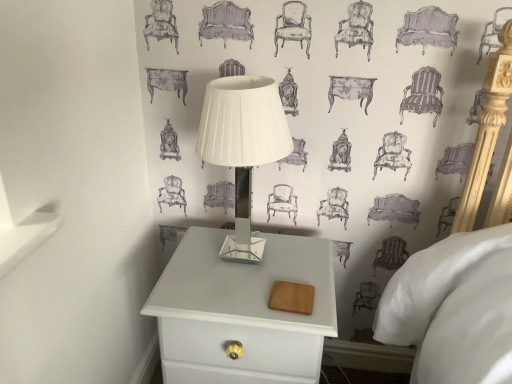
The height and width of the screenshot is (384, 512). In order to click on white glossy table lamp at center in this screenshot , I will do `click(243, 142)`.

This screenshot has width=512, height=384. What do you see at coordinates (243, 142) in the screenshot?
I see `white glossy table lamp at center` at bounding box center [243, 142].

Image resolution: width=512 pixels, height=384 pixels. What are the coordinates of `white matte nightstand at lower center` in the screenshot? It's located at (241, 311).

Describe the element at coordinates (241, 311) in the screenshot. The height and width of the screenshot is (384, 512). I see `white matte nightstand at lower center` at that location.

Where is `white glossy table lamp at center`? white glossy table lamp at center is located at coordinates (243, 142).

Between white matte nightstand at lower center and white glossy table lamp at center, which one appears on the left side from the viewer's perspective?

white glossy table lamp at center.

Which object is further away from the camera taking this photo, white matte nightstand at lower center or white glossy table lamp at center?

white matte nightstand at lower center is further away from the camera.

Is point (237, 373) in front of point (213, 162)?

No, it is not.

From the image's perspective, which is below, white matte nightstand at lower center or white glossy table lamp at center?

white matte nightstand at lower center.

From a real-world perspective, is white matte nightstand at lower center positioned above or below white glossy table lamp at center?

white matte nightstand at lower center is below white glossy table lamp at center.

Looking at their sizes, would you say white matte nightstand at lower center is wider or thinner than white glossy table lamp at center?

Considering their sizes, white matte nightstand at lower center looks broader than white glossy table lamp at center.

Who is taller, white matte nightstand at lower center or white glossy table lamp at center?

white matte nightstand at lower center is taller.

Does white matte nightstand at lower center have a larger size compared to white glossy table lamp at center?

Yes.

Does white matte nightstand at lower center contain white glossy table lamp at center?

No.

Is the surface of white matte nightstand at lower center in direct contact with white glossy table lamp at center?

white matte nightstand at lower center and white glossy table lamp at center are not in contact.

Looking at this image, is white matte nightstand at lower center positioned with its back to white glossy table lamp at center?

No, white matte nightstand at lower center is not facing the opposite direction of white glossy table lamp at center.

Can you tell me how much white matte nightstand at lower center and white glossy table lamp at center differ in facing direction?

The angle between the facing direction of white matte nightstand at lower center and the facing direction of white glossy table lamp at center is 1.54 degrees.

Image resolution: width=512 pixels, height=384 pixels. What are the coordinates of `nightstand below the white glossy table lamp at center (from a real-world perspective)` in the screenshot? It's located at (241, 311).

Which is more to the left, white glossy table lamp at center or white matte nightstand at lower center?

Positioned to the left is white glossy table lamp at center.

Who is more distant, white glossy table lamp at center or white matte nightstand at lower center?

white matte nightstand at lower center is further away from the camera.

Does point (246, 86) come behind point (242, 336)?

No, it is in front of (242, 336).

From the image's perspective, which one is positioned lower, white glossy table lamp at center or white matte nightstand at lower center?

white matte nightstand at lower center, from the image's perspective.

From a real-world perspective, between white glossy table lamp at center and white matte nightstand at lower center, who is vertically lower?

white matte nightstand at lower center, from a real-world perspective.

Can you confirm if white glossy table lamp at center is thinner than white matte nightstand at lower center?

Yes.

Can you confirm if white glossy table lamp at center is taller than white matte nightstand at lower center?

No, white glossy table lamp at center is not taller than white matte nightstand at lower center.

Between white glossy table lamp at center and white matte nightstand at lower center, which one has larger size?

With larger size is white matte nightstand at lower center.

Would you say white glossy table lamp at center is inside or outside white matte nightstand at lower center?

white glossy table lamp at center is located beyond the bounds of white matte nightstand at lower center.

Is white glossy table lamp at center far from white matte nightstand at lower center?

white glossy table lamp at center is near white matte nightstand at lower center, not far away.

Could you tell me if white glossy table lamp at center is turned towards white matte nightstand at lower center?

No, white glossy table lamp at center is not aimed at white matte nightstand at lower center.

How many degrees apart are the facing directions of white glossy table lamp at center and white matte nightstand at lower center?

The angular difference between white glossy table lamp at center and white matte nightstand at lower center is 1.54 degrees.

In order to click on nightstand that appears below the white glossy table lamp at center (from a real-world perspective) in this screenshot , I will do `click(241, 311)`.

You are a GUI agent. You are given a task and a screenshot of the screen. Output one action in this format:
    pyautogui.click(x=<x>, y=<y>)
    Task: Click on the nightstand behind the white glossy table lamp at center
    
    Given the screenshot: What is the action you would take?
    pyautogui.click(x=241, y=311)

Find the location of a particular element. This screenshot has width=512, height=384. table lamp that is above the white matte nightstand at lower center (from a real-world perspective) is located at coordinates (243, 142).